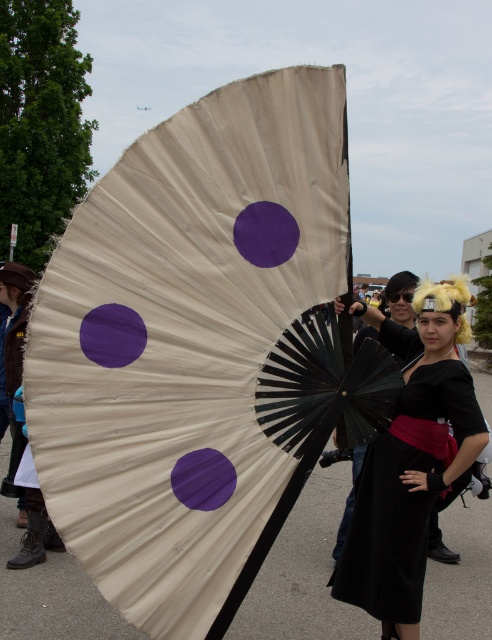
You are a photographer at the event and want to take a photo of the black velvet dress at center and the purple matte circle at center. Which object is positioned to the right side in the image?

The black velvet dress at center is positioned to the right of the purple matte circle at center.

You are standing at the origin point in the image. Which of the two points, point (369,529) or point (215,492), is farther away from you?

Point (369,529) is farther away from you than point (215,492).

You are a photographer at the event and want to capture a photo where the black velvet dress at center is visible above the purple matte circle at center. Is this possible based on their current positions?

The black velvet dress at center is currently below the purple matte circle at center, so adjusting the angle or position might be needed to make the dress visible above the circle.